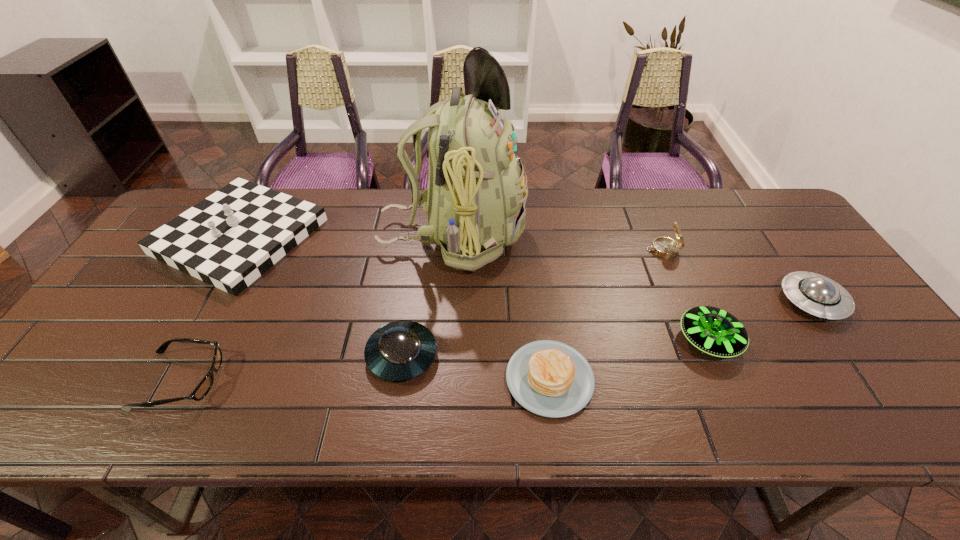
At what (x,y) coordinates should I click in order to perform the action: click on vacant area that lies between the backpack and the spectacles. Please return your answer as a coordinate pair (x, y). The height and width of the screenshot is (540, 960). Looking at the image, I should click on (317, 308).

I want to click on free space between the pancake and the spectacles, so click(x=365, y=380).

Image resolution: width=960 pixels, height=540 pixels. I want to click on free space that is in between the backpack and the seventh shortest object, so click(x=347, y=236).

What are the coordinates of `free space that is in between the backpack and the second saucer from left to right` in the screenshot? It's located at (581, 288).

At what (x,y) coordinates should I click in order to perform the action: click on free space between the checkerboard and the second saucer from left to right. Please return your answer as a coordinate pair (x, y). Image resolution: width=960 pixels, height=540 pixels. Looking at the image, I should click on (474, 288).

At what (x,y) coordinates should I click in order to perform the action: click on vacant space that's between the third tallest object and the spectacles. Please return your answer as a coordinate pair (x, y). Looking at the image, I should click on (421, 315).

I want to click on unoccupied area between the pancake and the second tallest object, so click(395, 307).

Where is `vacant area that lies between the second tallest object and the rightmost saucer`? vacant area that lies between the second tallest object and the rightmost saucer is located at coordinates (526, 269).

You are a GUI agent. You are given a task and a screenshot of the screen. Output one action in this format:
    pyautogui.click(x=<x>, y=<y>)
    Task: Click on the vacant area that lies between the spectacles and the checkerboard
    The image size is (960, 540).
    Given the screenshot: What is the action you would take?
    pyautogui.click(x=210, y=308)

At what (x,y) coordinates should I click in order to perform the action: click on vacant area that lies between the tallest object and the pancake. Please return your answer as a coordinate pair (x, y). This screenshot has width=960, height=540. Looking at the image, I should click on (501, 307).